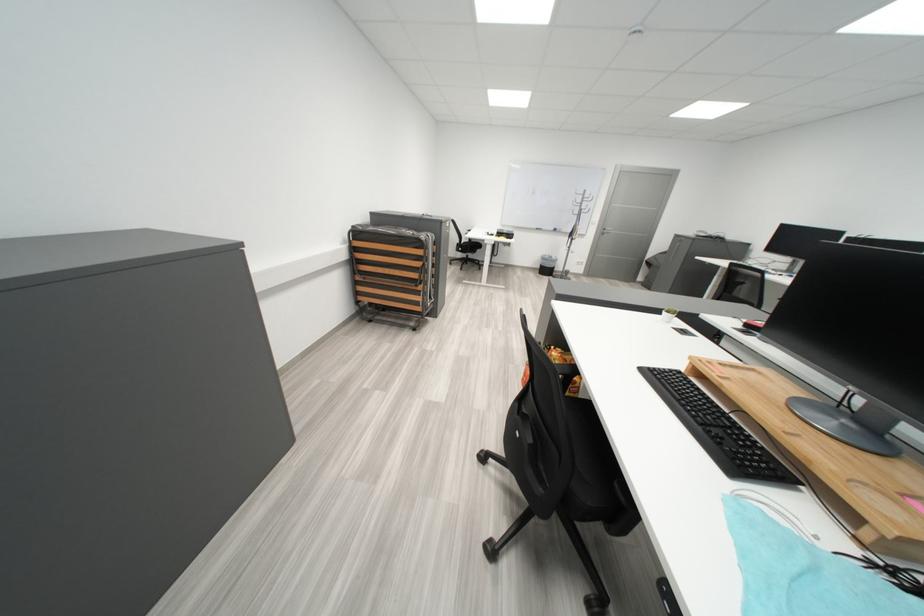
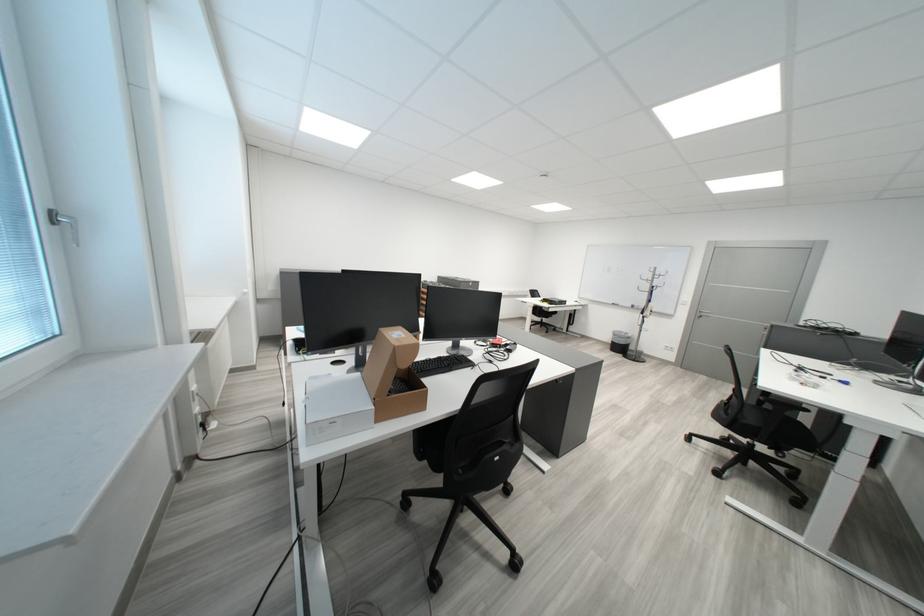
The point at (556, 261) is marked in the first image. Where is the corresponding point in the second image?

(627, 336)